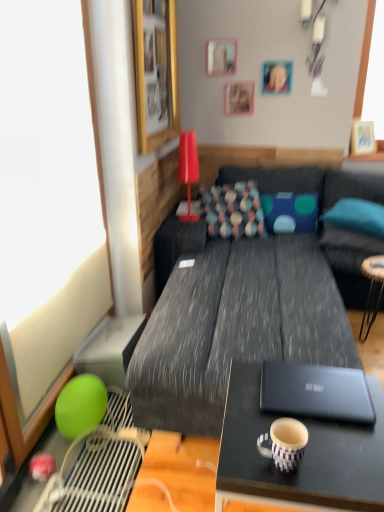
Image resolution: width=384 pixels, height=512 pixels. What are the coordinates of `vacant area on the back side of porcelain textured mug at center` in the screenshot? It's located at tap(261, 415).